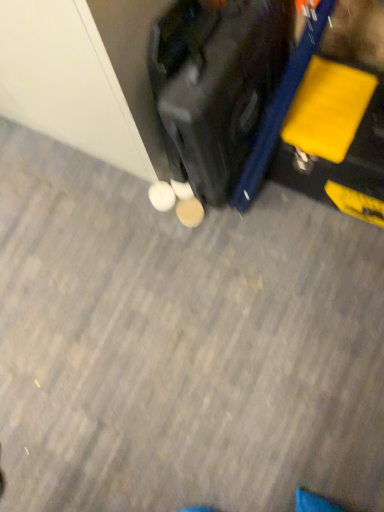
Question: Does white matte shoe at center, the 1th footwear from the right, have a larger size compared to white matte shoe at center, positioned as the second footwear in right-to-left order?

Choices:
 (A) no
 (B) yes

Answer: (A)

Question: Is white matte shoe at center, which ranks as the 2th footwear in left-to-right order, at the left side of white matte shoe at center, which is the first footwear in left-to-right order?

Choices:
 (A) yes
 (B) no

Answer: (B)

Question: Is white matte shoe at center, which ranks as the 2th footwear in left-to-right order, not within white matte shoe at center, positioned as the second footwear in right-to-left order?

Choices:
 (A) no
 (B) yes

Answer: (B)

Question: Considering the relative positions of white matte shoe at center, the 1th footwear from the right, and white matte shoe at center, positioned as the second footwear in right-to-left order, in the image provided, is white matte shoe at center, the 1th footwear from the right, behind white matte shoe at center, positioned as the second footwear in right-to-left order,?

Choices:
 (A) no
 (B) yes

Answer: (A)

Question: From the image's perspective, is white matte shoe at center, which ranks as the 2th footwear in left-to-right order, on top of white matte shoe at center, which is the first footwear in left-to-right order?

Choices:
 (A) no
 (B) yes

Answer: (A)

Question: Is point (180, 205) closer or farther from the camera than point (253, 14)?

Choices:
 (A) farther
 (B) closer

Answer: (A)

Question: From a real-world perspective, is white matte shoe at center, which ranks as the 2th footwear in left-to-right order, positioned above or below shiny black suitcase at center?

Choices:
 (A) above
 (B) below

Answer: (B)

Question: Looking at their shapes, would you say white matte shoe at center, the 1th footwear from the right, is wider or thinner than shiny black suitcase at center?

Choices:
 (A) thin
 (B) wide

Answer: (A)

Question: In terms of height, does white matte shoe at center, the 1th footwear from the right, look taller or shorter compared to shiny black suitcase at center?

Choices:
 (A) short
 (B) tall

Answer: (A)

Question: Is white matte shoe at center, the 1th footwear from the right, spatially inside white matte shoe at center, positioned as the second footwear in right-to-left order, or outside of it?

Choices:
 (A) inside
 (B) outside

Answer: (B)

Question: In the image, is white matte shoe at center, the 1th footwear from the right, on the left side or the right side of white matte shoe at center, positioned as the second footwear in right-to-left order?

Choices:
 (A) right
 (B) left

Answer: (A)

Question: From their relative heights in the image, would you say white matte shoe at center, which ranks as the 2th footwear in left-to-right order, is taller or shorter than white matte shoe at center, which is the first footwear in left-to-right order?

Choices:
 (A) tall
 (B) short

Answer: (B)

Question: From the image's perspective, is white matte shoe at center, which ranks as the 2th footwear in left-to-right order, located above or below white matte shoe at center, which is the first footwear in left-to-right order?

Choices:
 (A) above
 (B) below

Answer: (B)

Question: From a real-world perspective, is white matte shoe at center, positioned as the second footwear in right-to-left order, positioned above or below white matte shoe at center, the 1th footwear from the right?

Choices:
 (A) below
 (B) above

Answer: (B)

Question: Considering the positions of point (158, 199) and point (185, 201), is point (158, 199) closer or farther from the camera than point (185, 201)?

Choices:
 (A) closer
 (B) farther

Answer: (B)